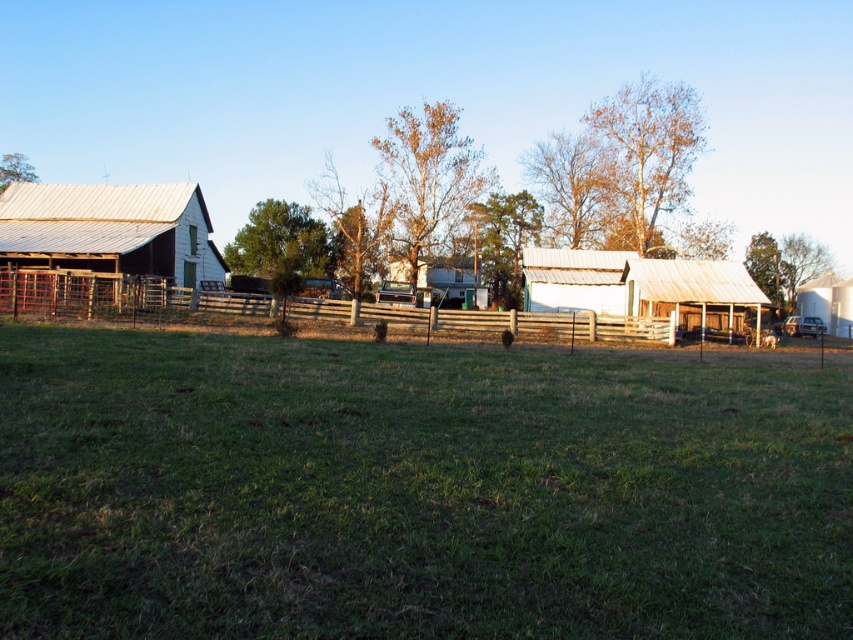
Question: Is green grassy field at center below white corrugated metal barn at center?

Choices:
 (A) no
 (B) yes

Answer: (B)

Question: Is green grassy field at center closer to the viewer compared to wooden fence at center?

Choices:
 (A) no
 (B) yes

Answer: (B)

Question: Based on their relative distances, which object is farther from the white matte silo at right?

Choices:
 (A) white corrugated metal barn at center
 (B) green grassy field at center
 (C) wooden fence at center

Answer: (B)

Question: Is white corrugated metal barn at left positioned at the back of white matte silo at right?

Choices:
 (A) no
 (B) yes

Answer: (A)

Question: Which point is closer to the camera?

Choices:
 (A) (173, 298)
 (B) (160, 282)

Answer: (A)

Question: Which object is closer to the camera taking this photo?

Choices:
 (A) white matte silo at right
 (B) white corrugated metal barn at center

Answer: (B)